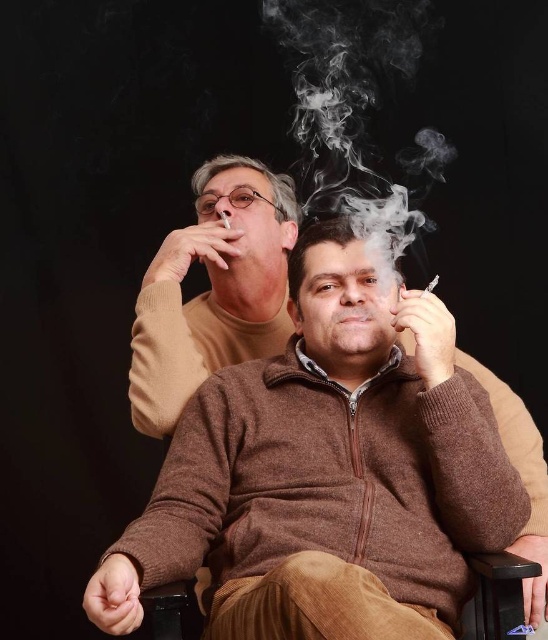
You are a photographer trying to capture the white smoke at center and the matte brown cigarette at upper center in a single shot. Which object should you adjust your focus on first to ensure both are in frame?

The matte brown cigarette at upper center is behind the white smoke at center, so you should focus on the matte brown cigarette at upper center first to ensure both are in frame.

You are standing in front of the image and notice the brown wool sweater at center and the white smoke at center. Which object is positioned more to the left side of the image?

The brown wool sweater at center is positioned to the left of the white smoke at center, so it is more to the left side of the image.